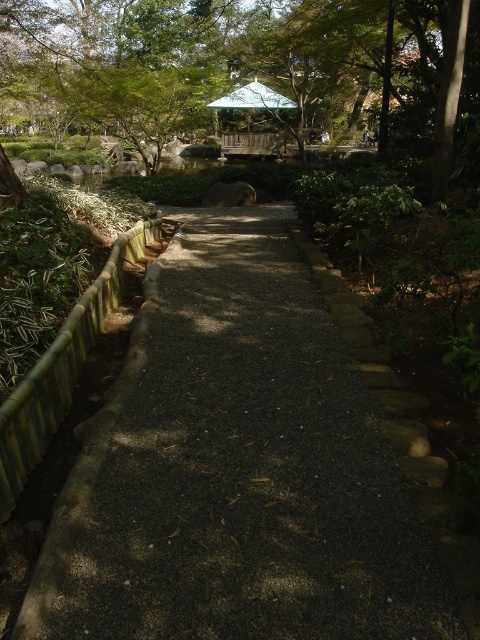
You are standing at the entrance of the garden and see the green leafy tree at upper left and the green wooden gazebo at upper center. Which object is positioned further to the left?

The green leafy tree at upper left is positioned further to the left compared to the green wooden gazebo at upper center.

You are a visitor in the garden and want to take a photo of the green leafy tree at upper left and the green wooden gazebo at upper center. Which object is positioned higher in the image?

The green leafy tree at upper left is positioned higher than the green wooden gazebo at upper center in the image.